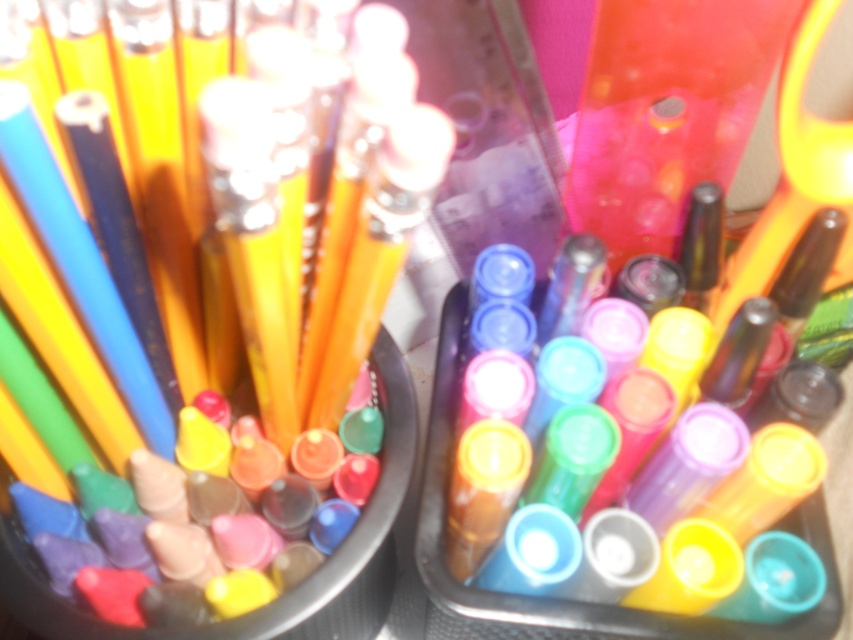
You are organizing a craft kit and need to place the yellow plastic scissors at upper right and the matte yellow pencil at center into a new box. Which object should you place first if you want to maintain their original positions relative to each other?

You should place the matte yellow pencil at center first because the yellow plastic scissors at upper right is to the right of it, so positioning the pencil first allows the scissors to be placed correctly to its right.

You are organizing a craft kit and need to place the yellow plastic scissors at upper right and the translucent plastic markers at center into a drawer. The scissors take up more space than the markers. Which object requires more space in the drawer?

The yellow plastic scissors at upper right requires more space in the drawer because it is bigger than the translucent plastic markers at center.

You are a photographer adjusting your camera to focus on two points in the image. The first point is labeled as point (316, 204) and the second is point (444, 490). Which point should you focus on first if you want to ensure both are in focus?

You should focus on point (316, 204) first because it is closer to the camera than point (444, 490). This allows the camera to adjust the focus starting from the nearest point, ensuring both points are within the depth of field.